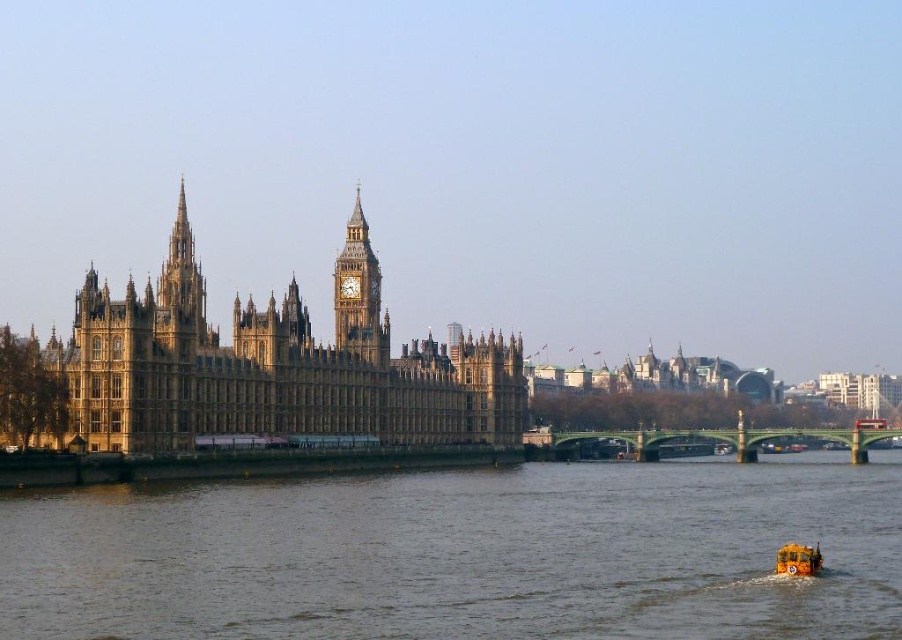
Question: Which of the following is the closest to the observer?

Choices:
 (A) golden stone clock tower at center
 (B) brown stone water at lower center
 (C) yellow rubber boat at lower right

Answer: (B)

Question: Which point is closer to the camera?

Choices:
 (A) (272, 352)
 (B) (833, 506)
 (C) (338, 333)
 (D) (163, 332)

Answer: (B)

Question: Where is golden stone clock tower at center located in relation to golden stone spire at upper left in the image?

Choices:
 (A) below
 (B) above

Answer: (A)

Question: Which is nearer to the golden stone clock tower at center?

Choices:
 (A) golden stone spire at upper left
 (B) brown stone water at lower center
 (C) brown stone castle at center
 (D) yellow rubber boat at lower right

Answer: (C)

Question: Does brown stone castle at center appear over yellow rubber boat at lower right?

Choices:
 (A) yes
 (B) no

Answer: (A)

Question: Where is brown stone castle at center located in relation to golden stone spire at upper left in the image?

Choices:
 (A) right
 (B) left

Answer: (A)